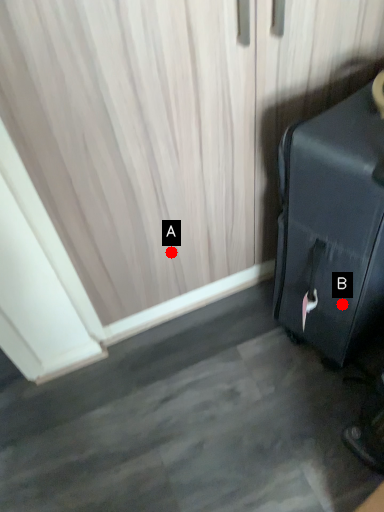
Question: Two points are circled on the image, labeled by A and B beside each circle. Which of the following is the closest to the observer?

Choices:
 (A) A is closer
 (B) B is closer

Answer: (B)